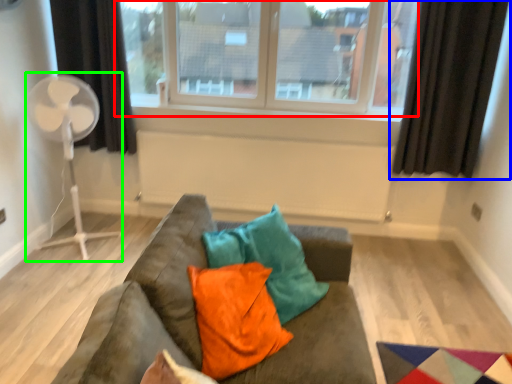
Question: Considering the real-world distances, which object is closest to window (highlighted by a red box)? curtain (highlighted by a blue box) or fan (highlighted by a green box).

Choices:
 (A) curtain
 (B) fan

Answer: (A)